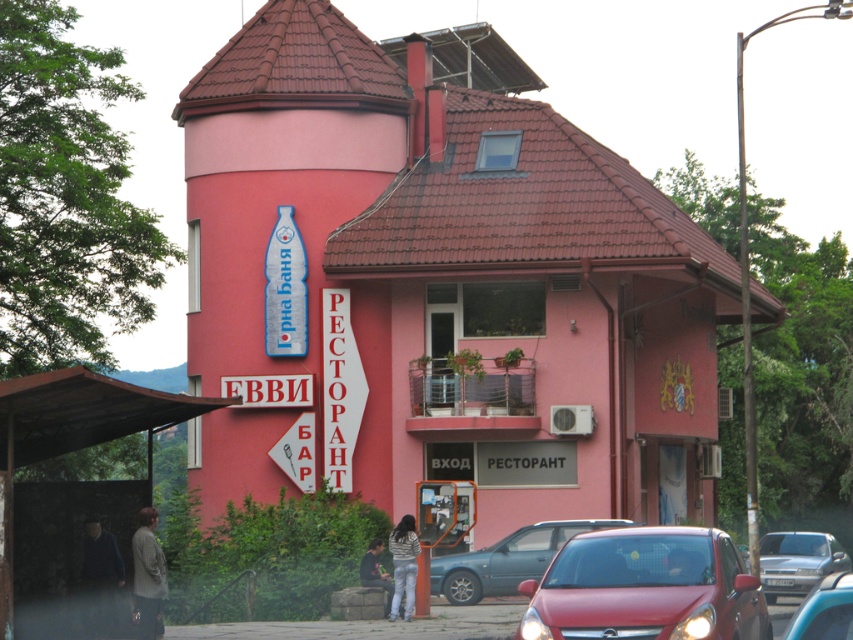
Question: Can you confirm if shiny red car at lower right is positioned below dark green fabric jacket at lower center?

Choices:
 (A) no
 (B) yes

Answer: (A)

Question: Considering the relative positions of shiny red car at lower right and dark gray sweater at lower left in the image provided, where is shiny red car at lower right located with respect to dark gray sweater at lower left?

Choices:
 (A) left
 (B) right

Answer: (B)

Question: Which object is closer to the camera taking this photo?

Choices:
 (A) shiny red car at lower right
 (B) dark gray sweater at lower left
 (C) matte pink building at center

Answer: (A)

Question: Estimate the real-world distances between objects in this image. Which object is closer to the metallic silver car at lower right?

Choices:
 (A) dark green fabric jacket at lower center
 (B) metallic silver sedan at center
 (C) metallic silver sedan at lower right
 (D) shiny red car at lower right

Answer: (C)

Question: Which of the following is the closest to the observer?

Choices:
 (A) metallic silver sedan at lower right
 (B) matte pink building at center

Answer: (B)

Question: Can you confirm if shiny red car at lower right is wider than striped fabric at lower center?

Choices:
 (A) no
 (B) yes

Answer: (B)